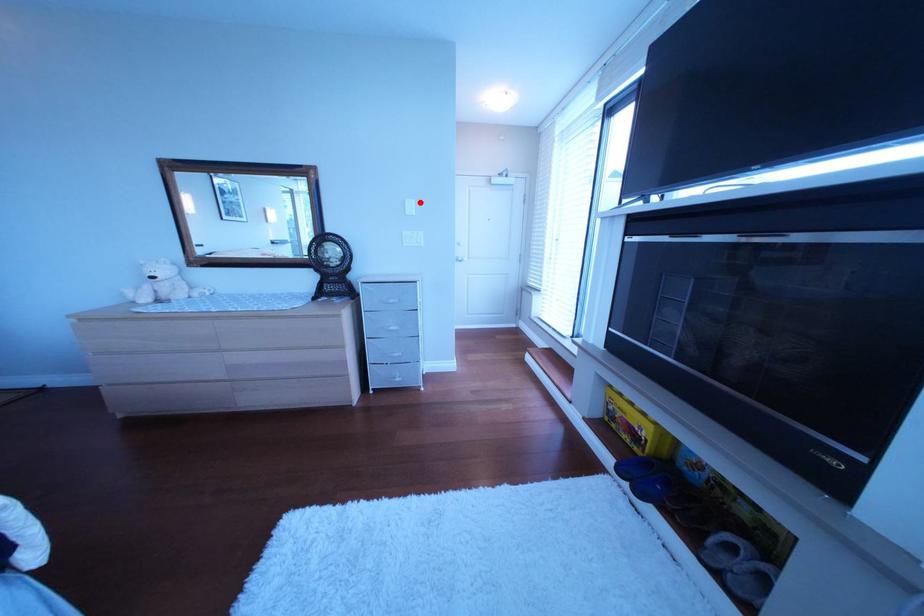
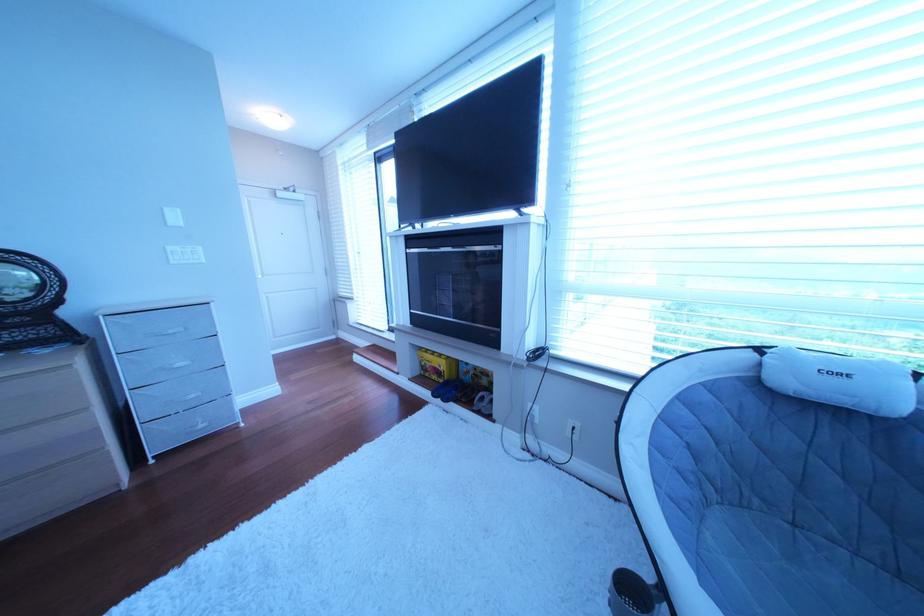
The point at the highlighted location is marked in the first image. Where is the corresponding point in the second image?

(177, 211)